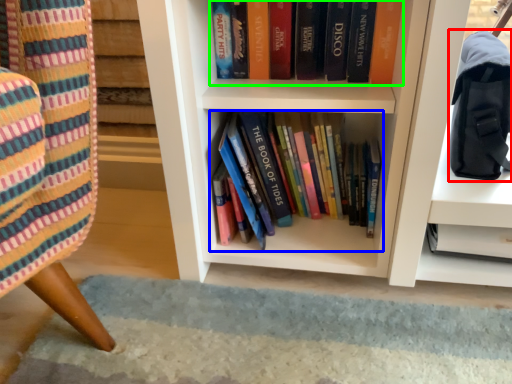
Question: Estimate the real-world distances between objects in this image. Which object is closer to shoulder bag (highlighted by a red box), book (highlighted by a blue box) or book (highlighted by a green box)?

Choices:
 (A) book
 (B) book

Answer: (B)